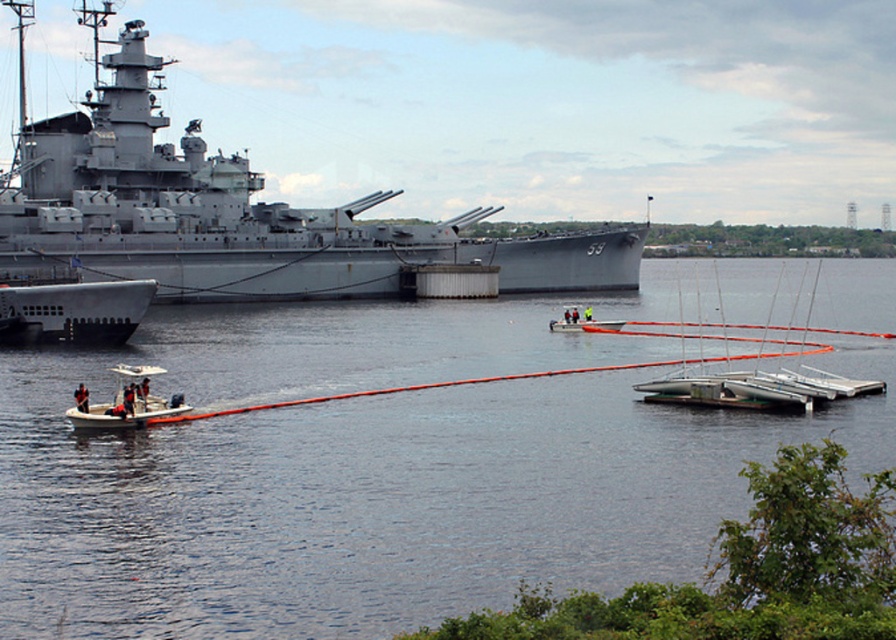
Based on the photo, you are a safety inspector reviewing this maritime scene. You need to determine if the dark blue fabric life vest at lower left is positioned within the safe zone for emergency equipment storage. The safe zone is defined as the area between coordinates 0.5 and 0.7 on the horizontal axis and between 0.1 and 0.2 on the vertical axis. Is the life vest within these coordinates?

The dark blue fabric life vest at lower left is positioned at point (142, 392). Since the horizontal coordinate 0.613 falls between 0.5 and 0.7, and the vertical coordinate 0.160 is within 0.1 to 0.2, the life vest is within the safe zone.

You are a safety inspector checking the watercraft in the scene. The orange rubber tube at center and the white plastic boat at left are both in use. According to safety regulations, the minimum width requirement for a boat carrying passengers is 1.2 meters. Can you determine which of the two watercraft meets this requirement?

The orange rubber tube at center has a width larger than the white plastic boat at left. Since the minimum requirement is 1.2 meters, the orange rubber tube at center likely meets the requirement, while the white plastic boat at left may not.

You are standing on the deck of the naval battleship and looking towards the pier. Which direction should you turn to face the white plastic boat at center?

You should turn to face the center direction since the white plastic boat at center is located at point (x=582, y=321), which is in the central area of the scene.